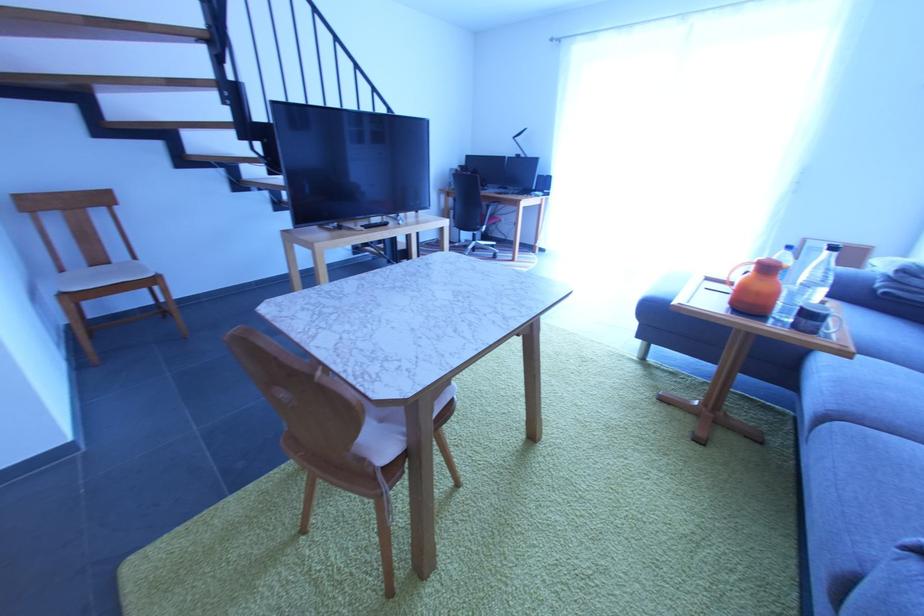
What do you see at coordinates (833, 246) in the screenshot? I see `a black bottle cap` at bounding box center [833, 246].